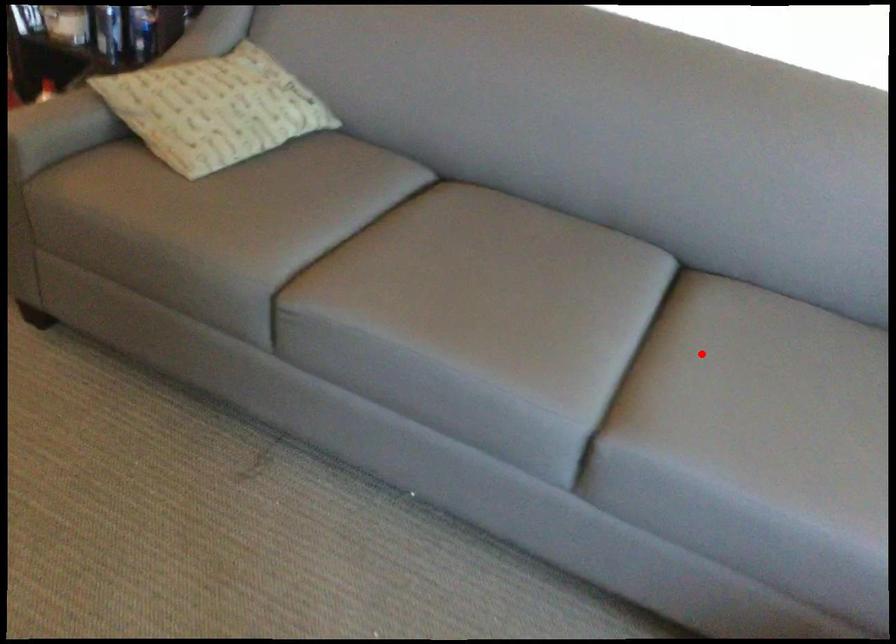
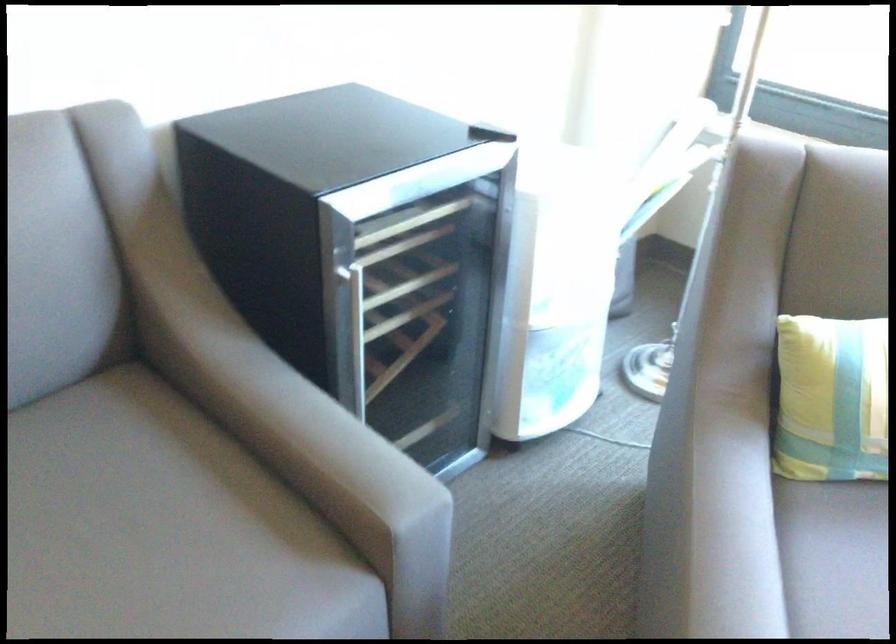
Where in the second image is the point corresponding to the highlighted location from the first image?

(83, 529)